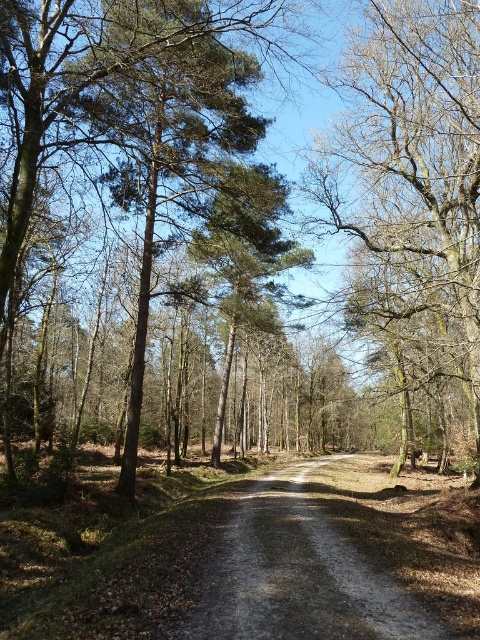
You are a hiker carrying a 10 feet long ladder. You want to place it between the two closest points between the bare wood tree at center and the nearest tree. Is the ladder long enough to span the distance?

The distance between the bare wood tree at center and the nearest tree is 40.78 feet. Since the ladder is only 10 feet long, it is not long enough to span the distance between them.